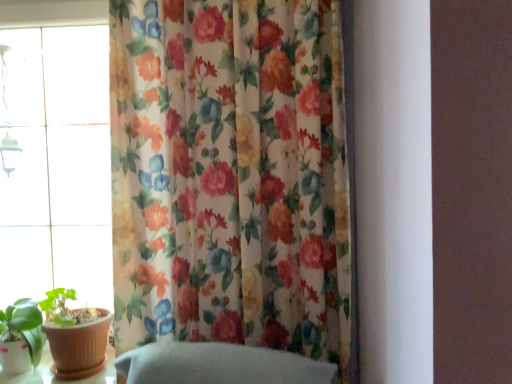
Locate an element on the screen. The height and width of the screenshot is (384, 512). floral fabric curtain at center is located at coordinates (232, 176).

What do you see at coordinates (232, 176) in the screenshot? I see `floral fabric curtain at center` at bounding box center [232, 176].

The width and height of the screenshot is (512, 384). What are the coordinates of `green matte leaf at lower left` in the screenshot? It's located at (21, 336).

Describe the element at coordinates (56, 151) in the screenshot. I see `transparent glass window at left` at that location.

You are a GUI agent. You are given a task and a screenshot of the screen. Output one action in this format:
    pyautogui.click(x=<x>, y=<y>)
    Task: Click on the floral fabric curtain at center
    This screenshot has width=512, height=384.
    Given the screenshot: What is the action you would take?
    pyautogui.click(x=232, y=176)

Is floral fabric curtain at center surrounded by transparent glass window at left?

No.

In the image, is transparent glass window at left positioned in front of or behind floral fabric curtain at center?

Clearly, transparent glass window at left is behind floral fabric curtain at center.

From the image's perspective, is transparent glass window at left located above floral fabric curtain at center?

Yes, from the image's perspective, transparent glass window at left is over floral fabric curtain at center.

Considering the sizes of objects transparent glass window at left and floral fabric curtain at center in the image provided, who is wider, transparent glass window at left or floral fabric curtain at center?

floral fabric curtain at center is wider.

Considering the sizes of floral fabric curtain at center and green matte leaf at lower left in the image, is floral fabric curtain at center bigger or smaller than green matte leaf at lower left?

→ In the image, floral fabric curtain at center appears to be larger than green matte leaf at lower left.

Is floral fabric curtain at center turned away from green matte leaf at lower left?

No, floral fabric curtain at center's orientation is not away from green matte leaf at lower left.

From the image's perspective, is floral fabric curtain at center above or below green matte leaf at lower left?

Clearly, from the image's perspective, floral fabric curtain at center is above green matte leaf at lower left.

Does floral fabric curtain at center appear on the right side of transparent glass window at left?

Correct, you'll find floral fabric curtain at center to the right of transparent glass window at left.

I want to click on curtain on the right of transparent glass window at left, so click(232, 176).

From a real-world perspective, between floral fabric curtain at center and transparent glass window at left, who is vertically lower?

From a 3D spatial view, floral fabric curtain at center is below.

Does floral fabric curtain at center have a greater height compared to transparent glass window at left?

In fact, floral fabric curtain at center may be shorter than transparent glass window at left.

Is green matte leaf at lower left positioned in front of floral fabric curtain at center?

No, green matte leaf at lower left is further to the viewer.

From the image's perspective, between green matte leaf at lower left and floral fabric curtain at center, who is located below?

green matte leaf at lower left is shown below in the image.

Is green matte leaf at lower left directly adjacent to floral fabric curtain at center?

No, green matte leaf at lower left is not beside floral fabric curtain at center.

Is green matte leaf at lower left turned away from transparent glass window at left?

Yes, transparent glass window at left is at the back of green matte leaf at lower left.

Based on the photo, considering the relative positions of green matte leaf at lower left and transparent glass window at left in the image provided, is green matte leaf at lower left to the left of transparent glass window at left from the viewer's perspective?

Correct, you'll find green matte leaf at lower left to the left of transparent glass window at left.

Based on the photo, do you think green matte leaf at lower left is within transparent glass window at left, or outside of it?

green matte leaf at lower left exists outside the volume of transparent glass window at left.

Consider the image. Between green matte leaf at lower left and transparent glass window at left, which one has smaller size?

green matte leaf at lower left.

Can you tell me how much transparent glass window at left and green matte leaf at lower left differ in facing direction?

2.3 degrees.

Where is `window behind the green matte leaf at lower left`? The width and height of the screenshot is (512, 384). window behind the green matte leaf at lower left is located at coordinates (56, 151).

Relative to green matte leaf at lower left, is transparent glass window at left in front or behind?

transparent glass window at left is positioned farther from the viewer than green matte leaf at lower left.

Locate an element on the screen. The width and height of the screenshot is (512, 384). window behind the floral fabric curtain at center is located at coordinates (56, 151).

Where is `houseplant that appears below the floral fabric curtain at center (from a real-world perspective)`? The height and width of the screenshot is (384, 512). houseplant that appears below the floral fabric curtain at center (from a real-world perspective) is located at coordinates (21, 336).

Which object lies nearer to the anchor point transparent glass window at left, green matte leaf at lower left or floral fabric curtain at center?

The object closer to transparent glass window at left is green matte leaf at lower left.

Which object lies nearer to the anchor point floral fabric curtain at center, transparent glass window at left or green matte leaf at lower left?

transparent glass window at left.

Considering their positions, is transparent glass window at left positioned further to green matte leaf at lower left than floral fabric curtain at center?

Among the two, floral fabric curtain at center is located further to green matte leaf at lower left.

Which object lies nearer to the anchor point transparent glass window at left, floral fabric curtain at center or green matte leaf at lower left?

Among the two, green matte leaf at lower left is located nearer to transparent glass window at left.

Considering their positions, is green matte leaf at lower left positioned closer to floral fabric curtain at center than transparent glass window at left?

The object closer to floral fabric curtain at center is transparent glass window at left.

Estimate the real-world distances between objects in this image. Which object is further from green matte leaf at lower left, floral fabric curtain at center or transparent glass window at left?

floral fabric curtain at center is positioned further to the anchor green matte leaf at lower left.

The image size is (512, 384). I want to click on window located between green matte leaf at lower left and floral fabric curtain at center in the left-right direction, so click(x=56, y=151).